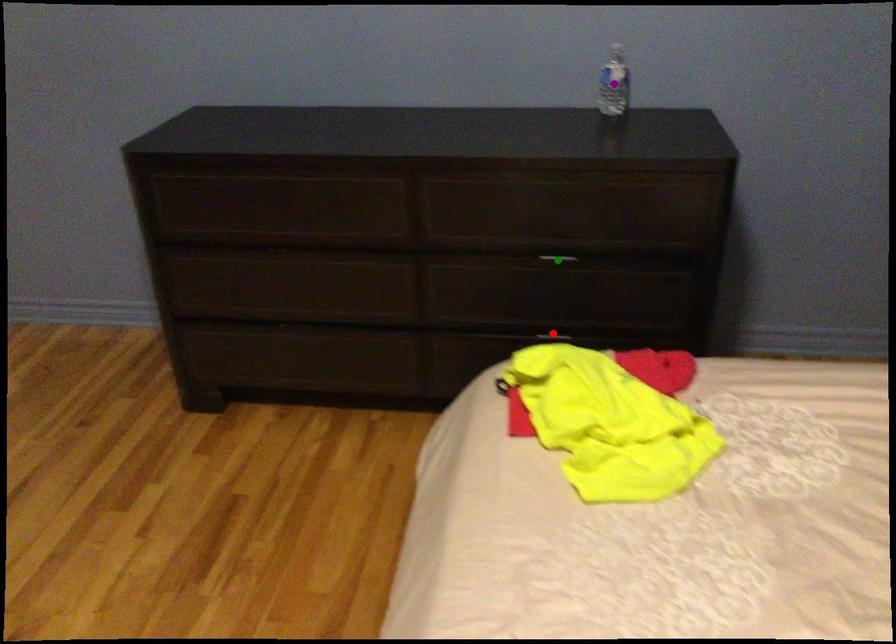
Order these from farthest to nearest:
- red point
- green point
- purple point

1. purple point
2. red point
3. green point